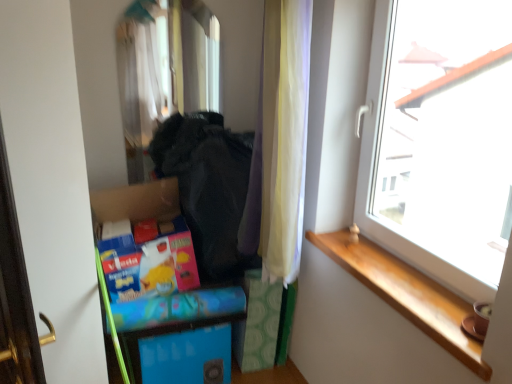
Find the location of `vacant space underneath transparent glass window at upper right (from a real-world perspective)`. vacant space underneath transparent glass window at upper right (from a real-world perspective) is located at coordinates (391, 263).